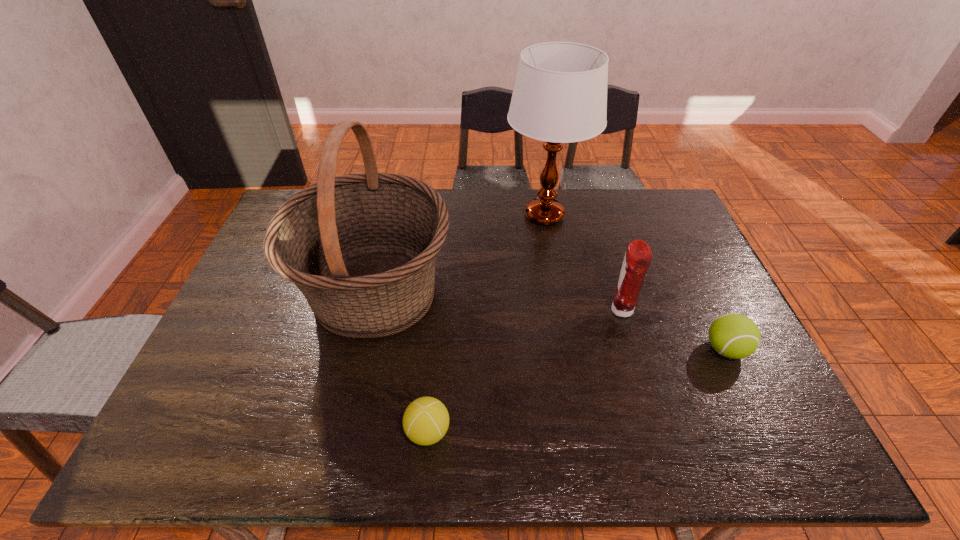
Find the location of a particular element. table lamp is located at coordinates [560, 94].

This screenshot has height=540, width=960. I want to click on basket, so click(361, 248).

Image resolution: width=960 pixels, height=540 pixels. I want to click on condiment, so click(638, 257).

What are the coordinates of `the right tennis ball` in the screenshot? It's located at (733, 335).

This screenshot has height=540, width=960. I want to click on the farther tennis ball, so click(733, 335).

You are a GUI agent. You are given a task and a screenshot of the screen. Output one action in this format:
    pyautogui.click(x=<x>, y=<y>)
    Task: Click on the nearer tennis ball
    
    Given the screenshot: What is the action you would take?
    pyautogui.click(x=426, y=420)

This screenshot has height=540, width=960. In order to click on the nearest object in this screenshot , I will do `click(426, 420)`.

Find the location of a particular element. The height and width of the screenshot is (540, 960). vacant space located on the left of the table lamp is located at coordinates (474, 215).

At what (x,y) coordinates should I click in order to perform the action: click on vacant space situated on the right of the basket. Please return your answer as a coordinate pair (x, y). Looking at the image, I should click on (536, 292).

Find the location of a particular element. The width and height of the screenshot is (960, 540). vacant area situated 0.050m on the left of the third shortest object is located at coordinates (589, 310).